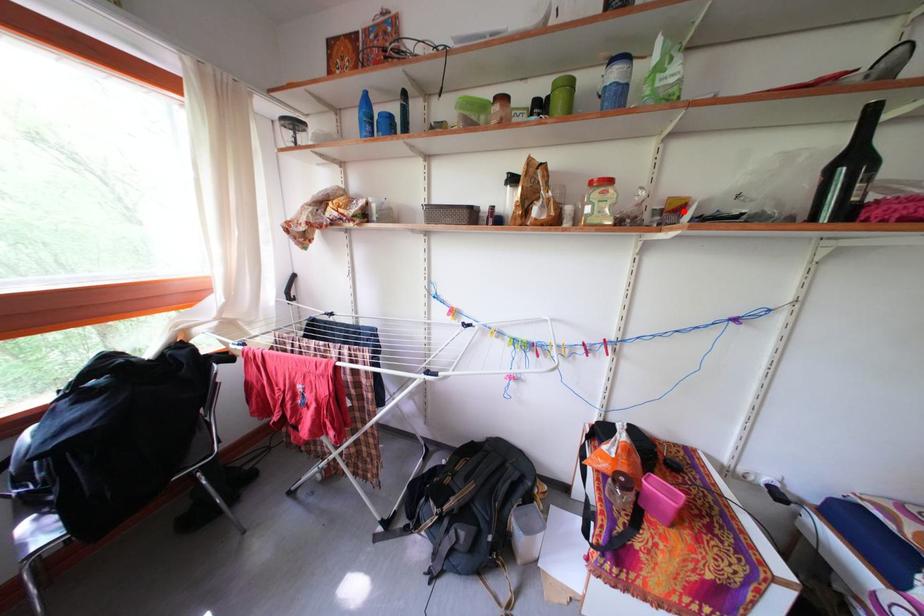
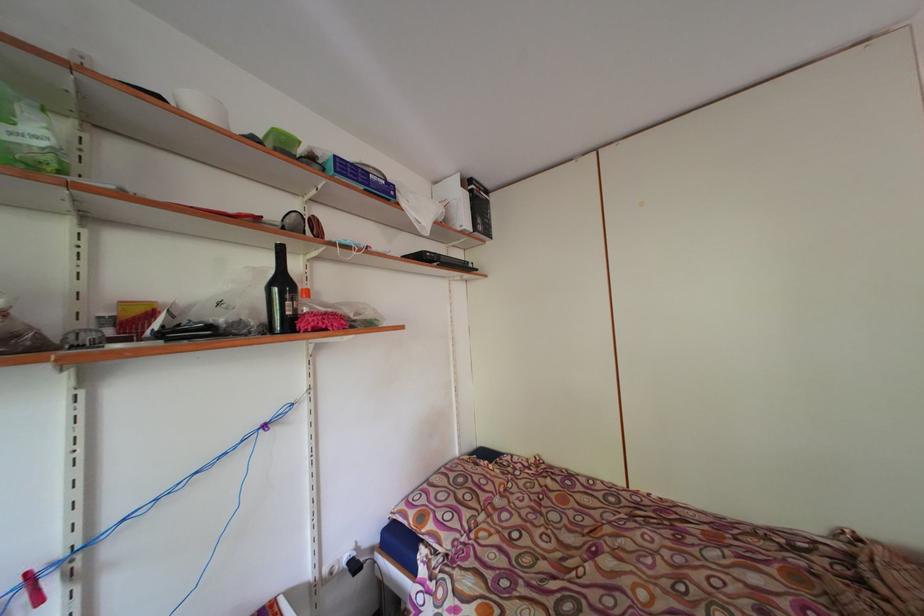
Question: I am providing you with two images of the same scene from different viewpoints. A red point is marked on the first image. Can you still see the location of the red point in image 2?

Choices:
 (A) Yes
 (B) No

Answer: (A)